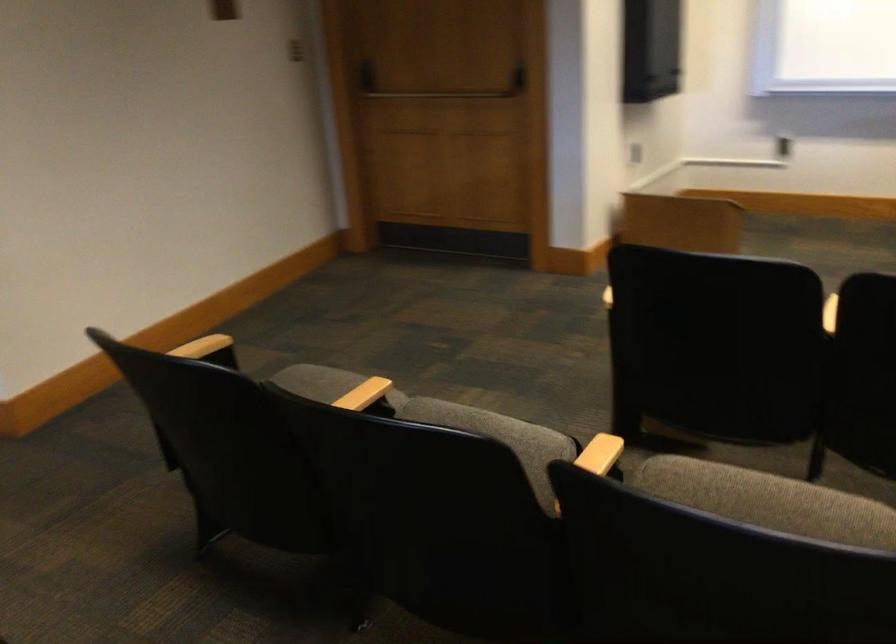
Where is `door push bar`? This screenshot has height=644, width=896. door push bar is located at coordinates (436, 96).